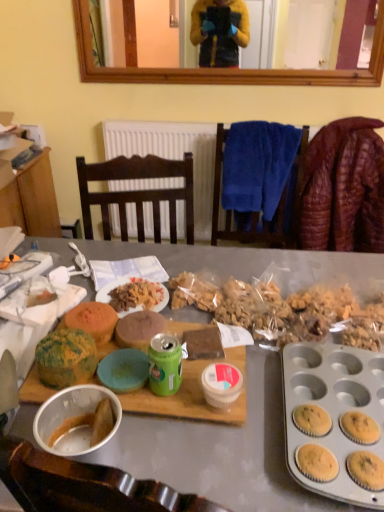
At what (x,y) coordinates should I click in order to perform the action: click on blank space situated above matte plastic plate at center (from a real-world perspective). Please return your answer as a coordinate pair (x, y). Looking at the image, I should click on (142, 291).